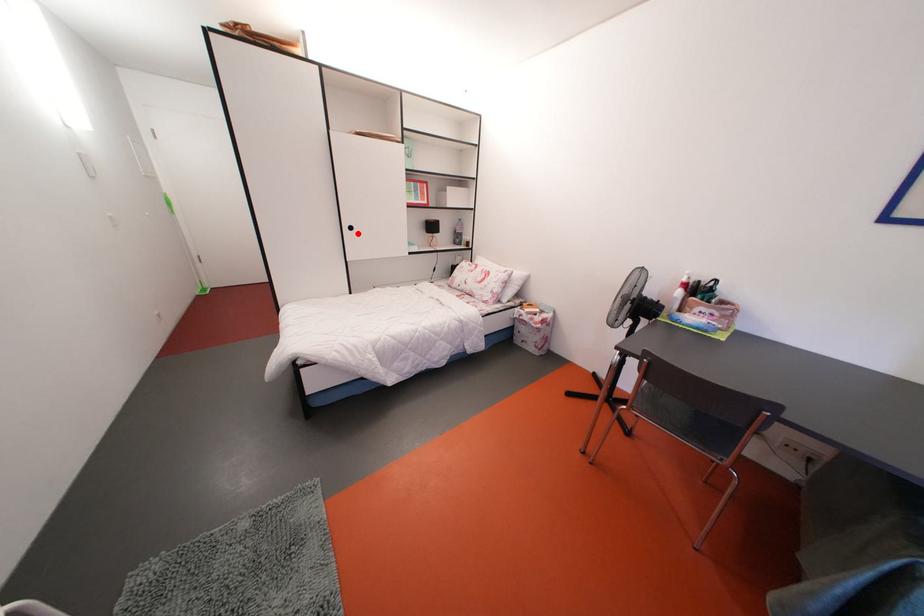
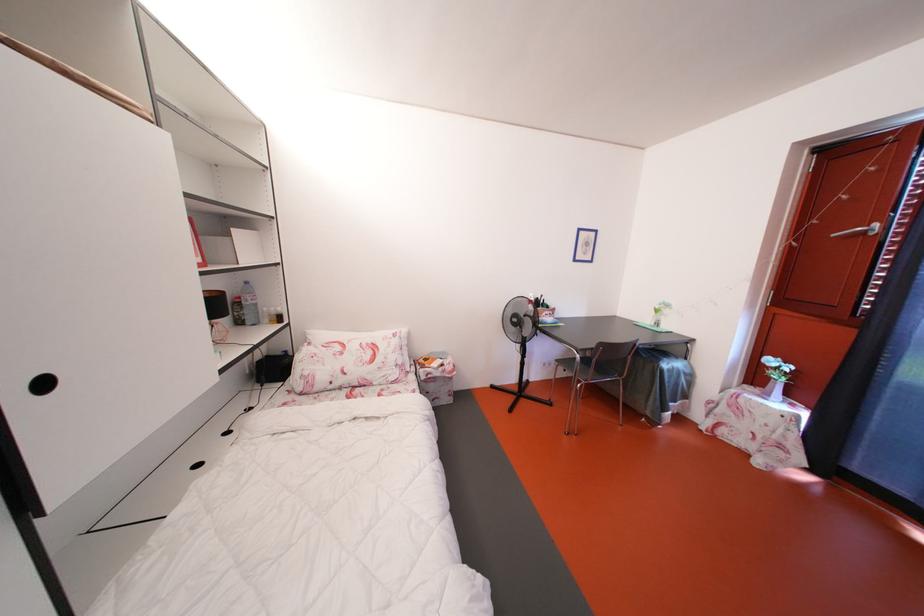
The point at the highlighted location is marked in the first image. Where is the corresponding point in the second image?

(52, 390)